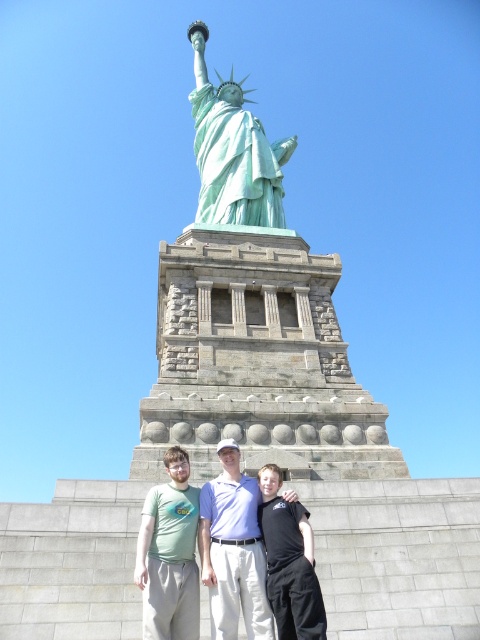
You are a photographer standing in front of the Statue of Liberty. You want to take a picture of the statue while wearing a green matte t shirt at center. Where should you position yourself to ensure the point at coordinates (169, 554) on your camera screen aligns with the green matte t shirt at center?

You should position yourself so that the point at coordinates (169, 554) on your camera screen aligns with the green matte t shirt at center, as the point is located on the green matte t shirt at center.

You are a tourist visiting the Statue of Liberty. You notice the green patina statue at center and the light blue shirt at center in the image. Which object is taller?

The green patina statue at center is much taller than the light blue shirt at center.